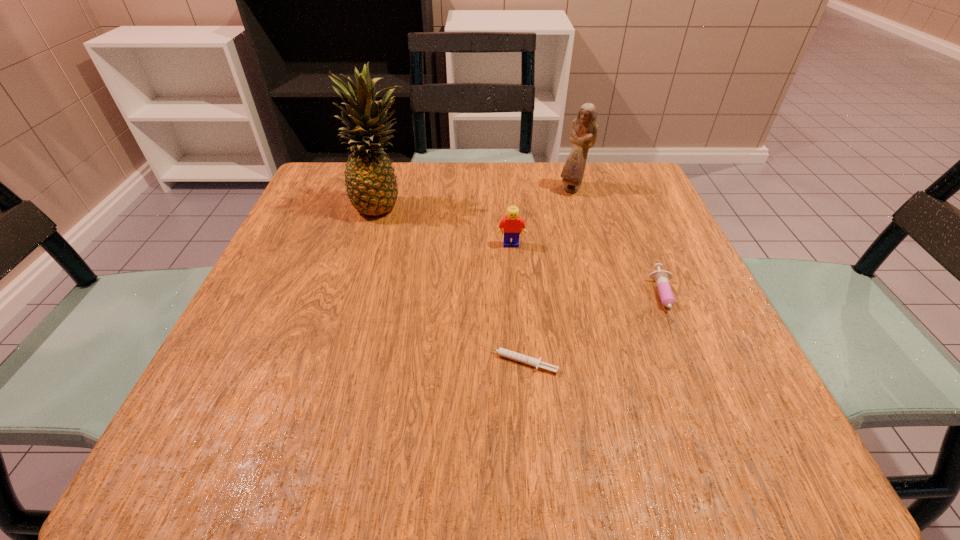
Locate an element on the screen. Image resolution: width=960 pixels, height=540 pixels. blank area in the image that satisfies the following two spatial constraints: 1. on the front-facing side of the third farthest object; 2. on the left side of the farther syringe is located at coordinates (516, 302).

This screenshot has height=540, width=960. In order to click on free space that satisfies the following two spatial constraints: 1. on the front side of the right syringe; 2. on the left side of the tallest object in this screenshot , I will do `click(356, 302)`.

At what (x,y) coordinates should I click in order to perform the action: click on free space that satisfies the following two spatial constraints: 1. on the front-facing side of the right syringe; 2. on the right side of the third tallest object. Please return your answer as a coordinate pair (x, y). This screenshot has height=540, width=960. Looking at the image, I should click on (516, 302).